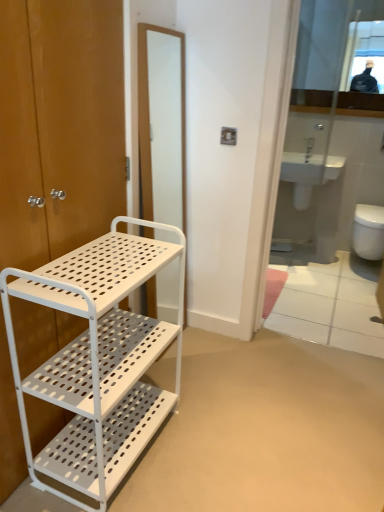
Question: Could you tell me if white plastic bidet at center is facing glossy glass mirror at upper right, acting as the 2th mirror starting from the front?

Choices:
 (A) no
 (B) yes

Answer: (A)

Question: Is white plastic bidet at center at the right side of glossy glass mirror at upper right, the first mirror when ordered from top to bottom?

Choices:
 (A) yes
 (B) no

Answer: (B)

Question: Is white plastic bidet at center located outside glossy glass mirror at upper right, acting as the 2th mirror starting from the front?

Choices:
 (A) yes
 (B) no

Answer: (A)

Question: Is white plastic bidet at center at the left side of glossy glass mirror at upper right, marked as the 1th mirror in a back-to-front arrangement?

Choices:
 (A) yes
 (B) no

Answer: (A)

Question: Does white plastic bidet at center have a lesser width compared to glossy glass mirror at upper right, the first mirror when ordered from top to bottom?

Choices:
 (A) yes
 (B) no

Answer: (B)

Question: Can you confirm if white plastic bidet at center is wider than glossy glass mirror at upper right, acting as the 2th mirror starting from the front?

Choices:
 (A) no
 (B) yes

Answer: (B)

Question: Is glossy glass mirror at upper right, the second mirror from the bottom, positioned with its back to white matte screen door at center?

Choices:
 (A) no
 (B) yes

Answer: (A)

Question: From the image's perspective, is glossy glass mirror at upper right, marked as the 1th mirror in a back-to-front arrangement, located above white matte screen door at center?

Choices:
 (A) yes
 (B) no

Answer: (A)

Question: Is glossy glass mirror at upper right, marked as the 1th mirror in a back-to-front arrangement, smaller than white matte screen door at center?

Choices:
 (A) no
 (B) yes

Answer: (B)

Question: Considering the relative sizes of glossy glass mirror at upper right, the first mirror when ordered from top to bottom, and white matte screen door at center in the image provided, is glossy glass mirror at upper right, the first mirror when ordered from top to bottom, shorter than white matte screen door at center?

Choices:
 (A) yes
 (B) no

Answer: (A)

Question: Would you say glossy glass mirror at upper right, marked as the 1th mirror in a back-to-front arrangement, is outside white matte screen door at center?

Choices:
 (A) yes
 (B) no

Answer: (A)

Question: From a real-world perspective, is glossy glass mirror at upper right, the first mirror when ordered from top to bottom, under white matte screen door at center?

Choices:
 (A) yes
 (B) no

Answer: (B)

Question: Can you confirm if white ceramic sink at center is positioned to the left of white perforated metal shelf at left?

Choices:
 (A) no
 (B) yes

Answer: (A)